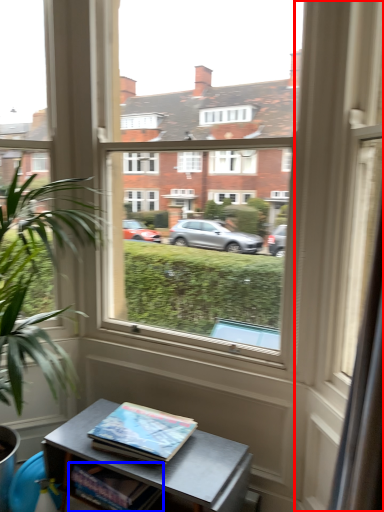
Question: Among these objects, which one is nearest to the camera, glass door (highlighted by a red box) or book (highlighted by a blue box)?

Choices:
 (A) glass door
 (B) book

Answer: (A)